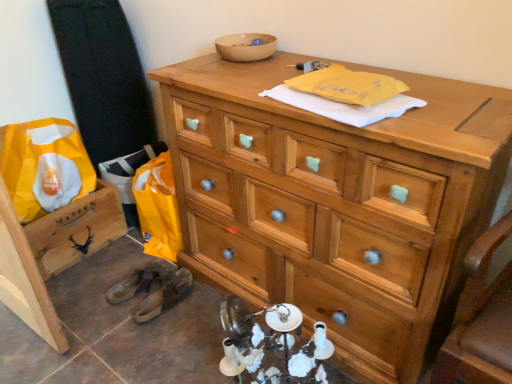
Where is `wooden bowl at upper center`? The height and width of the screenshot is (384, 512). wooden bowl at upper center is located at coordinates (246, 47).

Measure the distance between point [353,344] and camera.

The distance of point [353,344] from camera is 4.19 feet.

The image size is (512, 384). What do you see at coordinates (140, 282) in the screenshot?
I see `brown leather shoe at lower left, which is the 1th shoe in left-to-right order` at bounding box center [140, 282].

How much space does brown leather shoe at lower left, the 2th shoe when ordered from left to right, occupy horizontally?

29.34 centimeters.

The image size is (512, 384). What are the coordinates of `yellow paper bag at lower left` in the screenshot? It's located at (44, 167).

Considering the relative sizes of wooden crate at lower left and brown leather shoe at lower left, which is the 1th shoe in left-to-right order, in the image provided, is wooden crate at lower left shorter than brown leather shoe at lower left, which is the 1th shoe in left-to-right order,?

In fact, wooden crate at lower left may be taller than brown leather shoe at lower left, which is the 1th shoe in left-to-right order.

The width and height of the screenshot is (512, 384). There is a brown leather shoe at lower left, which is the 1th shoe in left-to-right order. What are the coordinates of `cabinetry above it (from a real-world perspective)` in the screenshot? It's located at (76, 230).

Which object is positioned more to the right, wooden crate at lower left or brown leather shoe at lower left, which is the 1th shoe in left-to-right order?

brown leather shoe at lower left, which is the 1th shoe in left-to-right order.

Is wooden crate at lower left inside or outside of brown leather shoe at lower left, which is the 1th shoe in left-to-right order?

wooden crate at lower left is outside brown leather shoe at lower left, which is the 1th shoe in left-to-right order.

Considering the sizes of objects brown leather shoe at lower left, which is the 1th shoe in left-to-right order, and wooden bowl at upper center in the image provided, who is thinner, brown leather shoe at lower left, which is the 1th shoe in left-to-right order, or wooden bowl at upper center?

Thinner between the two is wooden bowl at upper center.

From a real-world perspective, is brown leather shoe at lower left, which is the 1th shoe in left-to-right order, below wooden bowl at upper center?

Yes, from a real-world perspective, brown leather shoe at lower left, which is the 1th shoe in left-to-right order, is under wooden bowl at upper center.

Is brown leather shoe at lower left, which is the 1th shoe in left-to-right order, surrounding wooden bowl at upper center?

No, wooden bowl at upper center is not a part of brown leather shoe at lower left, which is the 1th shoe in left-to-right order.

Is brown leather shoe at lower left, the second shoe in the right-to-left sequence, at the left side of wooden bowl at upper center?

Yes, brown leather shoe at lower left, the second shoe in the right-to-left sequence, is to the left of wooden bowl at upper center.

Considering the relative positions of wooden chest of drawers at upper center and wooden crate at lower left in the image provided, is wooden chest of drawers at upper center to the left or to the right of wooden crate at lower left?

From the image, it's evident that wooden chest of drawers at upper center is to the right of wooden crate at lower left.

In the image, there is a wooden crate at lower left. Find the location of `the chest of drawers above it (from the image's perspective)`. the chest of drawers above it (from the image's perspective) is located at coordinates (336, 202).

Is wooden chest of drawers at upper center beside wooden crate at lower left?

They are not placed beside each other.

From the picture: Is wooden chest of drawers at upper center not within wooden crate at lower left?

Indeed, wooden chest of drawers at upper center is completely outside wooden crate at lower left.

Is yellow paper bag at lower left facing towards wooden chest of drawers at upper center?

Yes, yellow paper bag at lower left is turned towards wooden chest of drawers at upper center.

Does yellow paper bag at lower left contain wooden chest of drawers at upper center?

No.

From a real-world perspective, which is physically above, yellow paper bag at lower left or wooden chest of drawers at upper center?

wooden chest of drawers at upper center.

Does yellow paper bag at lower left appear on the right side of wooden chest of drawers at upper center?

No, yellow paper bag at lower left is not to the right of wooden chest of drawers at upper center.

Is yellow paper bag at lower left surrounded by brown leather shoe at lower left, which is the 1th shoe in left-to-right order?

That's incorrect, yellow paper bag at lower left is not inside brown leather shoe at lower left, which is the 1th shoe in left-to-right order.

You are a GUI agent. You are given a task and a screenshot of the screen. Output one action in this format:
    pyautogui.click(x=<x>, y=<y>)
    Task: Click on the shoe that is the 1st one when counting downward from the yellow paper bag at lower left (from the image's perspective)
    The width and height of the screenshot is (512, 384).
    Given the screenshot: What is the action you would take?
    pyautogui.click(x=140, y=282)

Are brown leather shoe at lower left, the second shoe in the right-to-left sequence, and yellow paper bag at lower left beside each other?

No, brown leather shoe at lower left, the second shoe in the right-to-left sequence, is not in contact with yellow paper bag at lower left.

Is yellow paper bag at lower left at the back of brown leather shoe at lower left, the second shoe in the right-to-left sequence?

brown leather shoe at lower left, the second shoe in the right-to-left sequence, is not turned away from yellow paper bag at lower left.

The width and height of the screenshot is (512, 384). What are the coordinates of `material behind the wooden bowl at upper center` in the screenshot? It's located at [44, 167].

Which is in front, point (223, 44) or point (17, 174)?

The point (223, 44) is in front.

Can you confirm if wooden bowl at upper center is taller than yellow paper bag at lower left?

Incorrect, the height of wooden bowl at upper center is not larger of that of yellow paper bag at lower left.

Consider the image. Are wooden bowl at upper center and yellow paper bag at lower left located far from each other?

wooden bowl at upper center is near yellow paper bag at lower left, not far away.

Between wooden crate at lower left and yellow paper bag at lower left, which one has larger size?

yellow paper bag at lower left is bigger.

Would you consider wooden crate at lower left to be distant from yellow paper bag at lower left?

Actually, wooden crate at lower left and yellow paper bag at lower left are a little close together.

How much distance is there between wooden crate at lower left and yellow paper bag at lower left?

A distance of 6.33 inches exists between wooden crate at lower left and yellow paper bag at lower left.

Between wooden crate at lower left and yellow paper bag at lower left, which one has larger width?

wooden crate at lower left.

Find the location of `the 1st shoe to the right of the wooden crate at lower left, counting from the anchor's position`. the 1st shoe to the right of the wooden crate at lower left, counting from the anchor's position is located at coordinates [140, 282].

Where is `bowl above the brown leather shoe at lower left, which is the 1th shoe in left-to-right order (from the image's perspective)`? Image resolution: width=512 pixels, height=384 pixels. bowl above the brown leather shoe at lower left, which is the 1th shoe in left-to-right order (from the image's perspective) is located at coordinates coord(246,47).

Based on their spatial positions, is wooden crate at lower left or wooden bowl at upper center further from brown leather shoe at lower left, the 2th shoe when ordered from left to right?

wooden bowl at upper center is positioned further to the anchor brown leather shoe at lower left, the 2th shoe when ordered from left to right.

From the image, which object appears to be farther from brown leather shoe at lower left, the first shoe when ordered from right to left, brown leather shoe at lower left, the second shoe in the right-to-left sequence, or wooden crate at lower left?

The object further to brown leather shoe at lower left, the first shoe when ordered from right to left, is wooden crate at lower left.

Looking at this image, estimate the real-world distances between objects in this image. Which object is further from yellow paper bag at lower left, wooden bowl at upper center or brown leather shoe at lower left, the first shoe when ordered from right to left?

wooden bowl at upper center is positioned further to the anchor yellow paper bag at lower left.

Based on their spatial positions, is wooden bowl at upper center or wooden chest of drawers at upper center further from yellow paper bag at lower left?

wooden chest of drawers at upper center is positioned further to the anchor yellow paper bag at lower left.

Considering their positions, is brown leather shoe at lower left, which is the 1th shoe in left-to-right order, positioned further to brown leather shoe at lower left, the first shoe when ordered from right to left, than wooden chest of drawers at upper center?

wooden chest of drawers at upper center is positioned further to the anchor brown leather shoe at lower left, the first shoe when ordered from right to left.

Based on their spatial positions, is wooden crate at lower left or brown leather shoe at lower left, the first shoe when ordered from right to left, further from wooden chest of drawers at upper center?

The object further to wooden chest of drawers at upper center is wooden crate at lower left.

From the image, which object appears to be farther from wooden bowl at upper center, wooden chest of drawers at upper center or brown leather shoe at lower left, the 2th shoe when ordered from left to right?

brown leather shoe at lower left, the 2th shoe when ordered from left to right, lies further to wooden bowl at upper center than the other object.

Which object lies nearer to the anchor point wooden bowl at upper center, brown leather shoe at lower left, which is the 1th shoe in left-to-right order, or wooden chest of drawers at upper center?

The object closer to wooden bowl at upper center is wooden chest of drawers at upper center.

This screenshot has width=512, height=384. In order to click on bowl between yellow paper bag at lower left and wooden chest of drawers at upper center in this screenshot , I will do `click(246, 47)`.

Where is `cabinetry located between yellow paper bag at lower left and wooden chest of drawers at upper center in the left-right direction`? cabinetry located between yellow paper bag at lower left and wooden chest of drawers at upper center in the left-right direction is located at coordinates (76, 230).

Find the location of a particular element. cabinetry between wooden bowl at upper center and brown leather shoe at lower left, the second shoe in the right-to-left sequence, from top to bottom is located at coordinates (76, 230).

Find the location of a particular element. This screenshot has width=512, height=384. bowl between wooden crate at lower left and wooden chest of drawers at upper center in the horizontal direction is located at coordinates (246, 47).